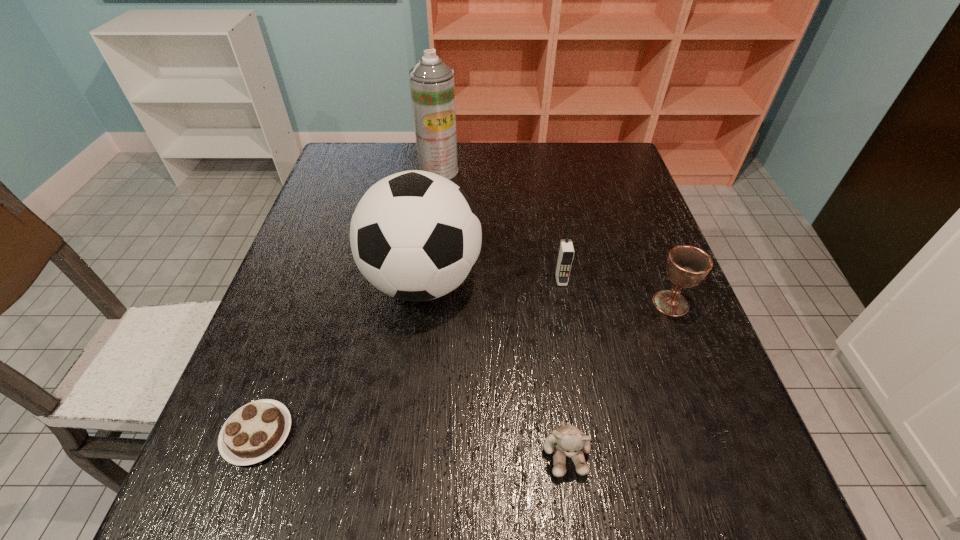
The height and width of the screenshot is (540, 960). I want to click on free space at the left edge of the desktop, so click(273, 353).

This screenshot has width=960, height=540. Find the location of `free region at the right edge`. free region at the right edge is located at coordinates (653, 424).

In the image, there is a desktop. At what (x,y) coordinates should I click in order to perform the action: click on vacant space at the near left corner. Please return your answer as a coordinate pair (x, y). This screenshot has width=960, height=540. Looking at the image, I should click on [x=269, y=492].

Locate an element on the screen. The image size is (960, 540). vacant space at the far right corner is located at coordinates (611, 148).

Find the location of a particular element. free space at the near right corner of the desktop is located at coordinates (775, 533).

Where is `free space between the second tallest object and the second shortest object`? Image resolution: width=960 pixels, height=540 pixels. free space between the second tallest object and the second shortest object is located at coordinates (494, 367).

Identify the location of free spot between the soccer ball and the second shortest object. The image size is (960, 540). (494, 367).

Find the location of a particular element. The width and height of the screenshot is (960, 540). vacant region between the fifth shortest object and the chalice is located at coordinates (546, 292).

Where is `vacant area that lies between the leftmost object and the second tallest object`? This screenshot has height=540, width=960. vacant area that lies between the leftmost object and the second tallest object is located at coordinates (340, 357).

This screenshot has width=960, height=540. I want to click on empty space that is in between the fourth tallest object and the aerosol can, so click(x=555, y=237).